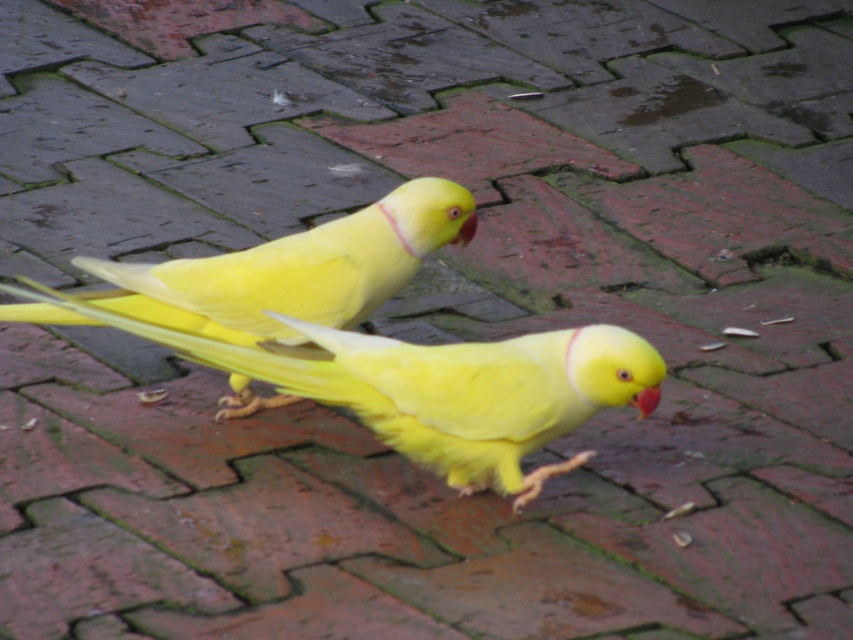
This screenshot has width=853, height=640. What do you see at coordinates (646, 401) in the screenshot?
I see `yellow matte beak at center` at bounding box center [646, 401].

Between point (633, 397) and point (471, 220), which one is positioned in front?

Positioned in front is point (633, 397).

What do you see at coordinates (646, 401) in the screenshot? This screenshot has height=640, width=853. I see `yellow matte beak at center` at bounding box center [646, 401].

Identify the location of yellow matte beak at center. The width and height of the screenshot is (853, 640). (646, 401).

Which is behind, point (184, 307) or point (648, 394)?

Point (184, 307)

The image size is (853, 640). What do you see at coordinates (293, 269) in the screenshot? I see `yellow matte canary at center` at bounding box center [293, 269].

Find the location of a particular element. The image size is (853, 640). yellow matte canary at center is located at coordinates (293, 269).

Is point (647, 353) positioned in front of point (642, 417)?

Yes, point (647, 353) is closer to viewer.

Does yellow matte parrot at center appear on the right side of yellow matte beak at center?

Incorrect, yellow matte parrot at center is not on the right side of yellow matte beak at center.

At what (x,y) coordinates should I click in order to perform the action: click on yellow matte parrot at center. Please return your answer as a coordinate pair (x, y). This screenshot has width=853, height=640. Looking at the image, I should click on (439, 388).